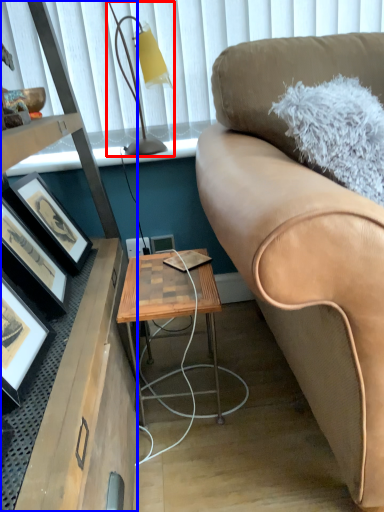
Question: Which object appears farthest to the camera in this image, table lamp (highlighted by a red box) or desk (highlighted by a blue box)?

Choices:
 (A) table lamp
 (B) desk

Answer: (A)